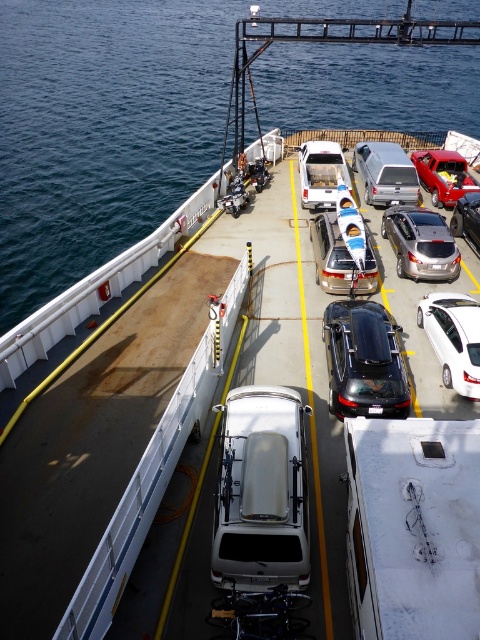
Question: Among these points, which one is nearest to the camera?

Choices:
 (A) (369, 396)
 (B) (335, 168)

Answer: (A)

Question: Does white matte van at center have a greater width compared to silver metallic truck at center?

Choices:
 (A) no
 (B) yes

Answer: (B)

Question: Which point is farther from the camera taking this photo?

Choices:
 (A) (263, 435)
 (B) (368, 262)
 (C) (368, 179)

Answer: (C)

Question: Does satin silver suv at center have a lesser width compared to silver metallic truck at center?

Choices:
 (A) no
 (B) yes

Answer: (A)

Question: Does glossy black car at center appear over silver metallic truck at center?

Choices:
 (A) yes
 (B) no

Answer: (B)

Question: Among these objects, which one is farthest from the camera?

Choices:
 (A) white glossy sedan at center
 (B) white matte van at center
 (C) glossy black car at center
 (D) satin silver sedan at center

Answer: (D)